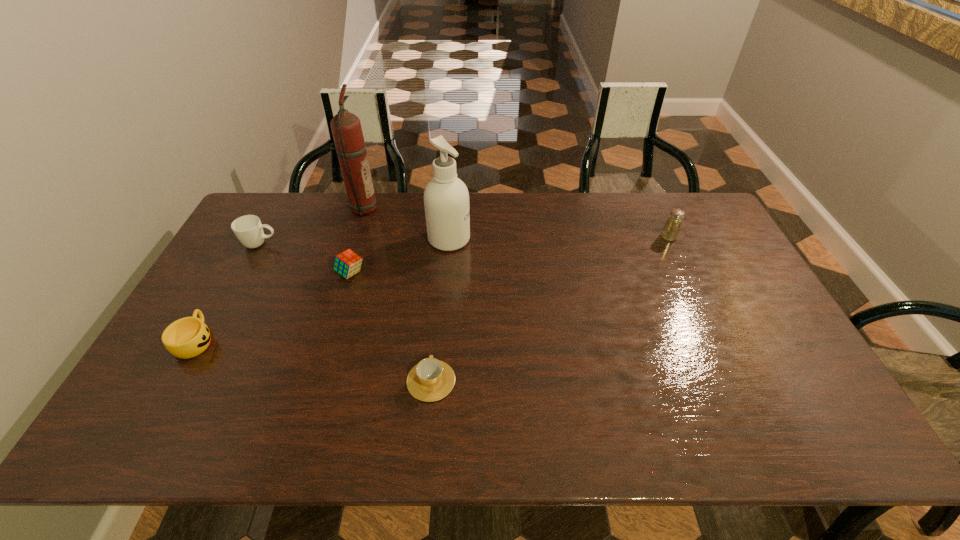
Locate an element on the screen. The image size is (960, 540). fire extinguisher is located at coordinates (346, 128).

The height and width of the screenshot is (540, 960). I want to click on the second tallest object, so click(x=446, y=198).

Locate an element on the screen. Image resolution: width=960 pixels, height=540 pixels. saltshaker is located at coordinates (670, 232).

This screenshot has width=960, height=540. I want to click on the rightmost object, so click(670, 232).

This screenshot has height=540, width=960. Find the location of `the tallest cup`. the tallest cup is located at coordinates (248, 229).

Locate an element on the screen. the fifth farthest object is located at coordinates (348, 263).

You are a GUI agent. You are given a task and a screenshot of the screen. Output one action in this format:
    pyautogui.click(x=<x>, y=<y>)
    Task: Click on the rightmost cup
    Image resolution: width=960 pixels, height=540 pixels.
    Given the screenshot: What is the action you would take?
    pyautogui.click(x=430, y=380)

Where is `free space located 0.310m on the side of the farthest object with the label and nozzle`? The height and width of the screenshot is (540, 960). free space located 0.310m on the side of the farthest object with the label and nozzle is located at coordinates (464, 209).

The width and height of the screenshot is (960, 540). I want to click on free spot located 0.290m on the front label of the cleansing agent, so click(x=557, y=239).

Find the location of a particular element. The image size is (960, 540). free space located on the back of the fifth shortest object is located at coordinates (655, 207).